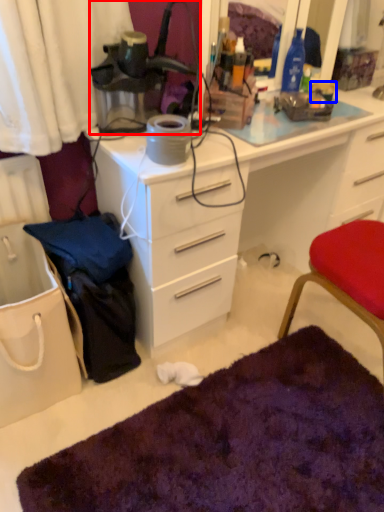
Question: Among these objects, which one is nearest to the camera, lamp (highlighted by a red box) or coffee cup (highlighted by a blue box)?

Choices:
 (A) lamp
 (B) coffee cup

Answer: (A)